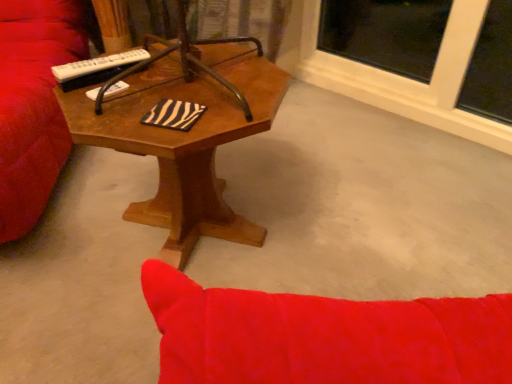
Question: From the image's perspective, does wooden coffee table at center appear higher than white plastic remote at upper left?

Choices:
 (A) yes
 (B) no

Answer: (B)

Question: Can you confirm if wooden coffee table at center is positioned to the right of white plastic remote at upper left?

Choices:
 (A) yes
 (B) no

Answer: (A)

Question: Does wooden coffee table at center have a lesser width compared to white plastic remote at upper left?

Choices:
 (A) no
 (B) yes

Answer: (A)

Question: Does wooden coffee table at center come in front of white plastic remote at upper left?

Choices:
 (A) no
 (B) yes

Answer: (B)

Question: Does wooden coffee table at center have a greater width compared to white plastic remote at upper left?

Choices:
 (A) yes
 (B) no

Answer: (A)

Question: Is wooden coffee table at center facing away from white plastic remote at upper left?

Choices:
 (A) no
 (B) yes

Answer: (A)

Question: From the image's perspective, is white plastic remote at upper left on top of wooden coffee table at center?

Choices:
 (A) no
 (B) yes

Answer: (B)

Question: From the image's perspective, is white plastic remote at upper left below wooden coffee table at center?

Choices:
 (A) no
 (B) yes

Answer: (A)

Question: From a real-world perspective, is white plastic remote at upper left under wooden coffee table at center?

Choices:
 (A) yes
 (B) no

Answer: (B)

Question: Considering the relative sizes of white plastic remote at upper left and wooden coffee table at center in the image provided, is white plastic remote at upper left smaller than wooden coffee table at center?

Choices:
 (A) no
 (B) yes

Answer: (B)

Question: Is white plastic remote at upper left oriented away from wooden coffee table at center?

Choices:
 (A) yes
 (B) no

Answer: (A)

Question: Can you confirm if white plastic remote at upper left is thinner than wooden coffee table at center?

Choices:
 (A) yes
 (B) no

Answer: (A)

Question: Based on their positions, is wooden coffee table at center located to the left or right of white plastic remote at upper left?

Choices:
 (A) left
 (B) right

Answer: (B)